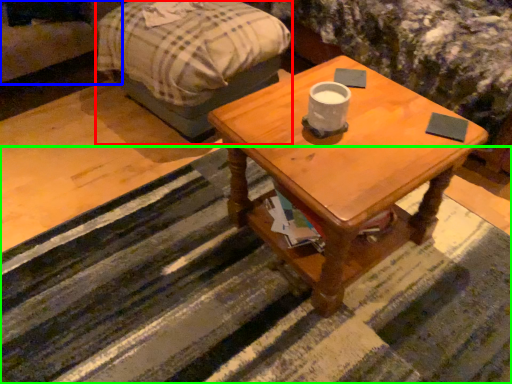
Question: Which is nearer to the bed frame (highlighted by a red box)? couch (highlighted by a blue box) or strip (highlighted by a green box).

Choices:
 (A) couch
 (B) strip

Answer: (A)